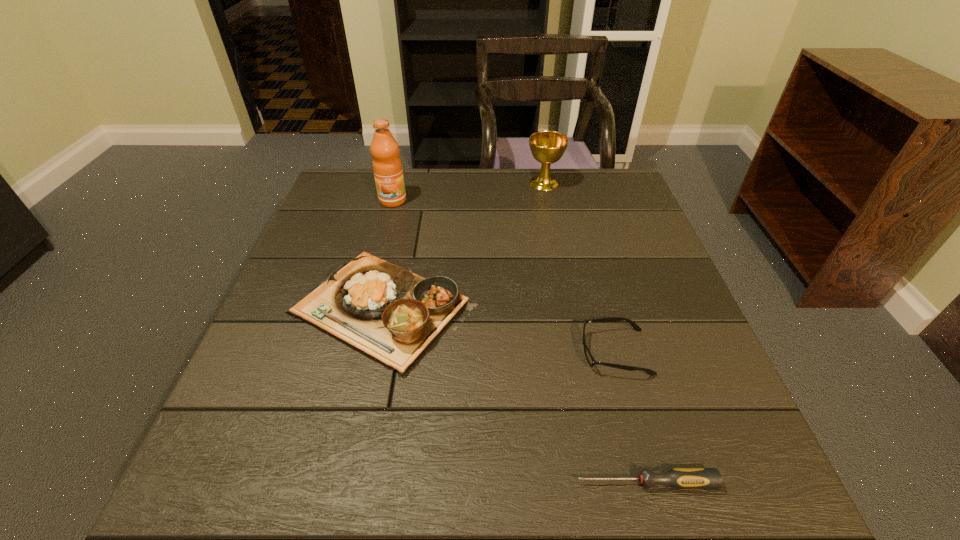
Image resolution: width=960 pixels, height=540 pixels. What are the coordinates of `unoccupied position between the third shortest object and the spectacles` in the screenshot? It's located at (498, 331).

Locate which object is the closest to the fruit juice. Please provide its 2D coordinates. Your answer should be formatted as a tuple, i.e. [(x, y)], where the tuple contains the x and y coordinates of a point satisfying the conditions above.

[(393, 315)]

Locate an element on the screen. Image resolution: width=960 pixels, height=540 pixels. object that is the second nearest to the third shortest object is located at coordinates (387, 166).

Identify the location of free point that satisfies the following two spatial constraints: 1. on the label side of the tallest object; 2. on the left side of the third shortest object. (364, 310).

The width and height of the screenshot is (960, 540). In order to click on free space that satisfies the following two spatial constraints: 1. on the label side of the second farthest object; 2. on the left side of the platter in this screenshot , I will do `click(364, 310)`.

At what (x,y) coordinates should I click in order to perform the action: click on vacant area in the image that satisfies the following two spatial constraints: 1. on the back side of the fourth shortest object; 2. on the right side of the platter. Please return your answer as a coordinate pair (x, y). The height and width of the screenshot is (540, 960). Looking at the image, I should click on (410, 183).